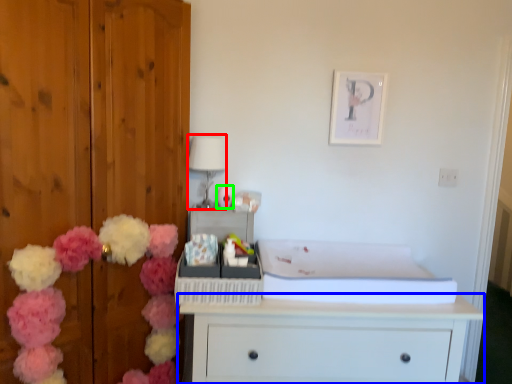
Question: Estimate the real-world distances between objects in this image. Which object is closer to lamp (highlighted by a red box), chest of drawers (highlighted by a blue box) or toy (highlighted by a green box)?

Choices:
 (A) chest of drawers
 (B) toy

Answer: (B)